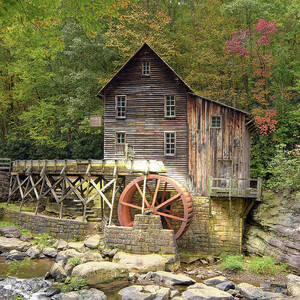
Identify the location of windows. This screenshot has width=300, height=300. (219, 121), (169, 135), (170, 108), (119, 103), (146, 71).